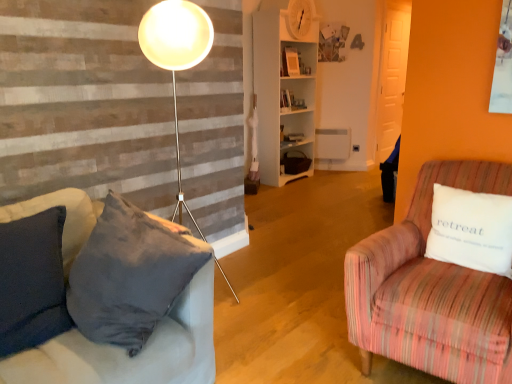
Question: From the image's perspective, would you say white cotton pillow at right is positioned over white wooden shelf at center?

Choices:
 (A) no
 (B) yes

Answer: (A)

Question: From a real-world perspective, does white cotton pillow at right stand above white wooden shelf at center?

Choices:
 (A) no
 (B) yes

Answer: (A)

Question: Considering the relative sizes of white cotton pillow at right and white wooden shelf at center in the image provided, is white cotton pillow at right bigger than white wooden shelf at center?

Choices:
 (A) no
 (B) yes

Answer: (A)

Question: Does white cotton pillow at right have a greater height compared to white wooden shelf at center?

Choices:
 (A) no
 (B) yes

Answer: (A)

Question: Considering the relative positions of white cotton pillow at right and white wooden shelf at center in the image provided, is white cotton pillow at right behind white wooden shelf at center?

Choices:
 (A) no
 (B) yes

Answer: (A)

Question: Is white cotton pillow at right aimed at white wooden shelf at center?

Choices:
 (A) yes
 (B) no

Answer: (B)

Question: Can you confirm if white wooden shelf at center is taller than white cotton pillow at right?

Choices:
 (A) yes
 (B) no

Answer: (A)

Question: Does white wooden shelf at center appear on the right side of white cotton pillow at right?

Choices:
 (A) no
 (B) yes

Answer: (A)

Question: From a real-world perspective, does white wooden shelf at center sit lower than white cotton pillow at right?

Choices:
 (A) yes
 (B) no

Answer: (B)

Question: Is white wooden shelf at center not within white cotton pillow at right?

Choices:
 (A) no
 (B) yes

Answer: (B)

Question: From the image's perspective, is white wooden shelf at center beneath white cotton pillow at right?

Choices:
 (A) no
 (B) yes

Answer: (A)

Question: Would you say white cotton pillow at right is part of white wooden shelf at center's contents?

Choices:
 (A) yes
 (B) no

Answer: (B)

Question: From a real-world perspective, is white cotton pillow at right positioned over striped fabric armchair at right based on gravity?

Choices:
 (A) no
 (B) yes

Answer: (B)